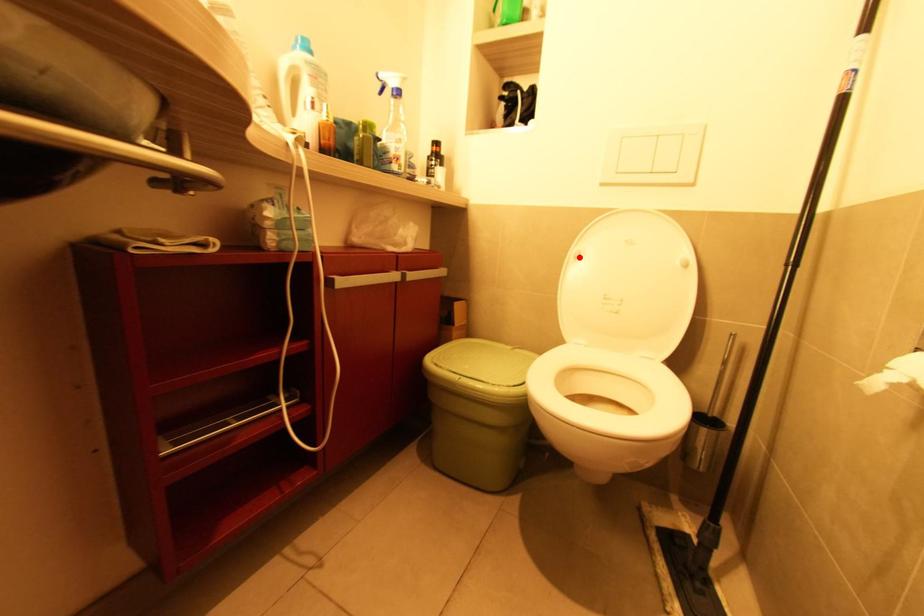
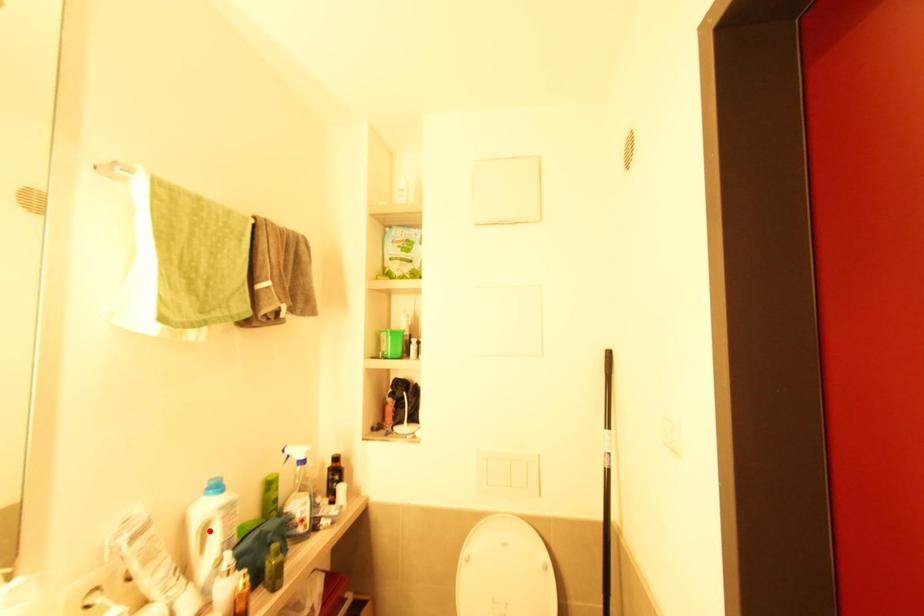
I am providing you with two images of the same scene from different viewpoints. A red point is marked on the first image and another point is marked on the second image. Is the red point in image1 aligned with the point shown in image2?

No